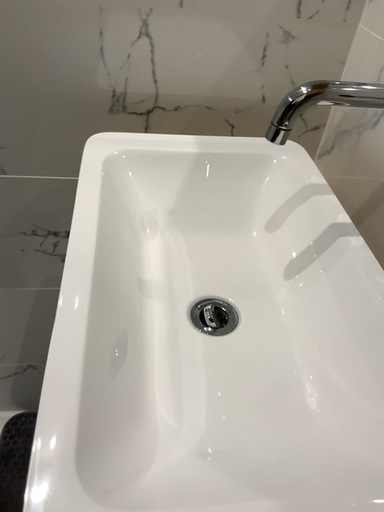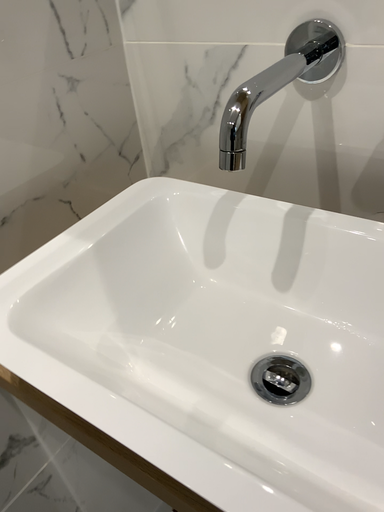
Question: How did the camera likely rotate when shooting the video?

Choices:
 (A) rotated upward
 (B) rotated downward

Answer: (A)